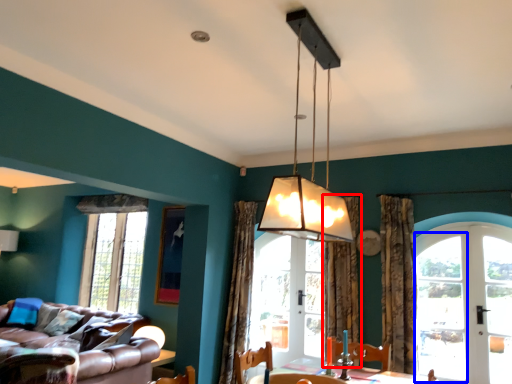
Question: Which object appears farthest to the camera in this image, curtain (highlighted by a red box) or glass door (highlighted by a blue box)?

Choices:
 (A) curtain
 (B) glass door

Answer: (A)